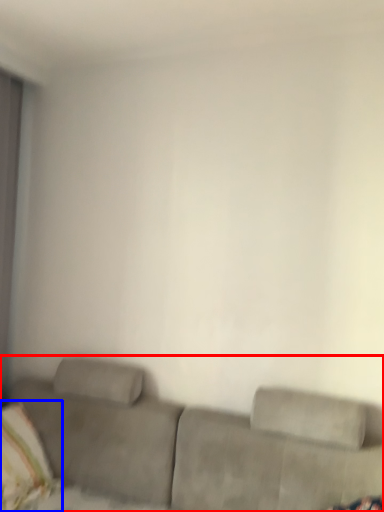
Question: Which of the following is the closest to the observer, studio couch (highlighted by a red box) or pillow (highlighted by a blue box)?

Choices:
 (A) studio couch
 (B) pillow

Answer: (A)